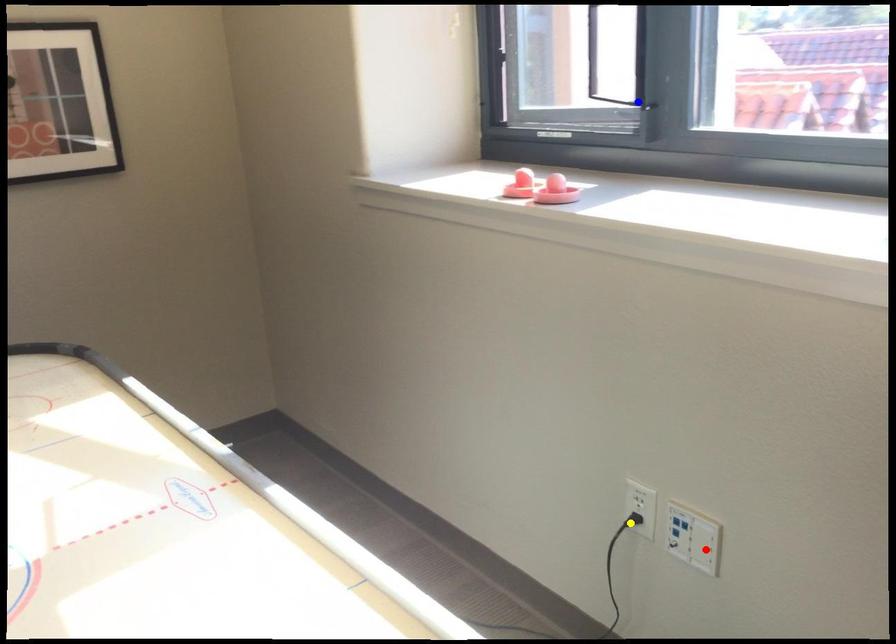
Order these from nearest to farthest:
A) blue point
B) red point
C) yellow point

red point
yellow point
blue point